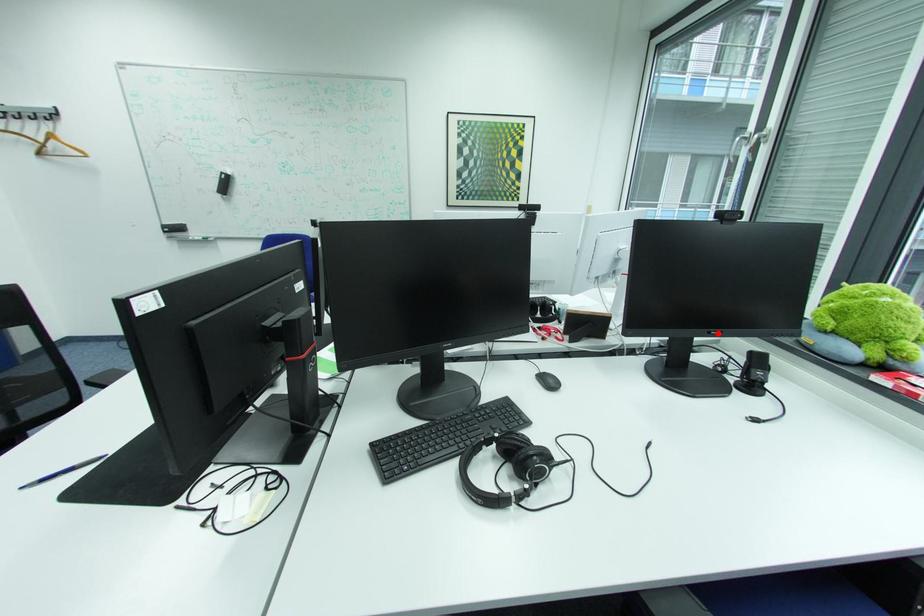
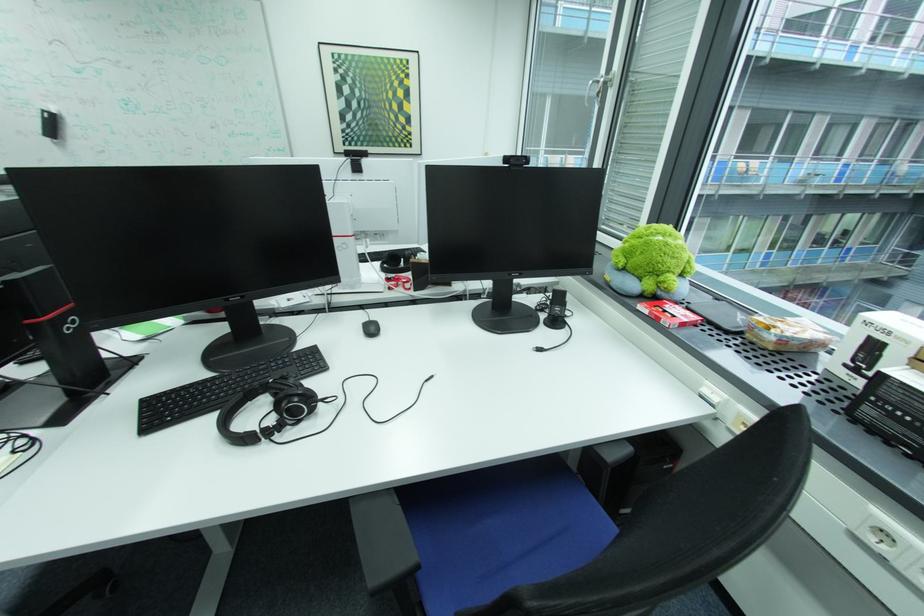
Question: I am providing you with two images of the same scene from different viewpoints. Given a red point in image1, look at the same physical point in image2. Is it:

Choices:
 (A) Closer to the viewpoint
 (B) Farther from the viewpoint

Answer: (B)